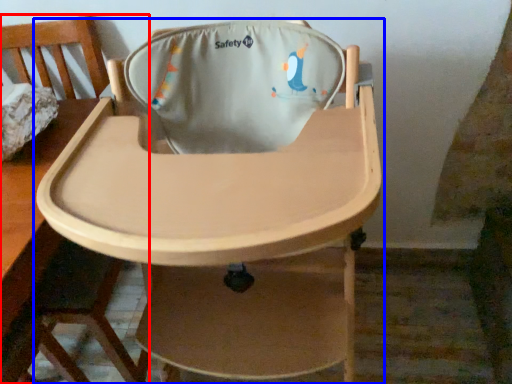
Question: Which object appears closest to the camera in this image, chair (highlighted by a red box) or chair (highlighted by a blue box)?

Choices:
 (A) chair
 (B) chair

Answer: (B)